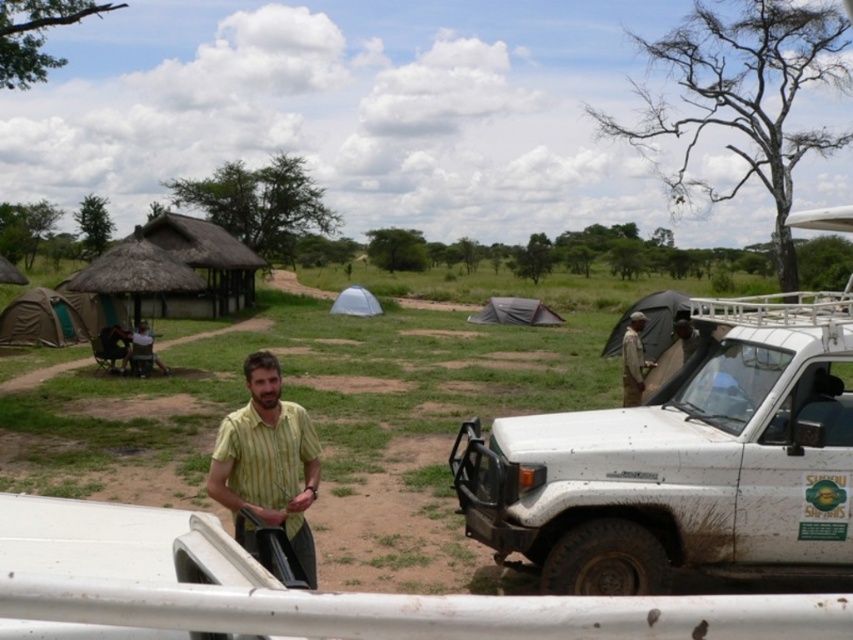
Question: Based on their relative distances, which object is nearer to the white matte jeep at right?

Choices:
 (A) khaki fabric jacket at center
 (B) light brown leather jacket at center
 (C) yellow striped shirt at center
 (D) white matte pickup truck at center

Answer: (C)

Question: Can you confirm if white matte jeep at right is smaller than yellow striped shirt at center?

Choices:
 (A) no
 (B) yes

Answer: (A)

Question: Which of these objects is positioned closest to the khaki fabric jacket at center?

Choices:
 (A) yellow striped shirt at center
 (B) white matte jeep at right
 (C) white matte pickup truck at center

Answer: (B)

Question: Can you confirm if white matte jeep at right is bigger than white matte pickup truck at center?

Choices:
 (A) yes
 (B) no

Answer: (B)

Question: Which point is closer to the camera taking this photo?

Choices:
 (A) (241, 440)
 (B) (688, 332)
 (C) (798, 564)
 (D) (637, 362)

Answer: (A)

Question: Is white matte jeep at right bigger than light brown leather jacket at center?

Choices:
 (A) yes
 (B) no

Answer: (B)